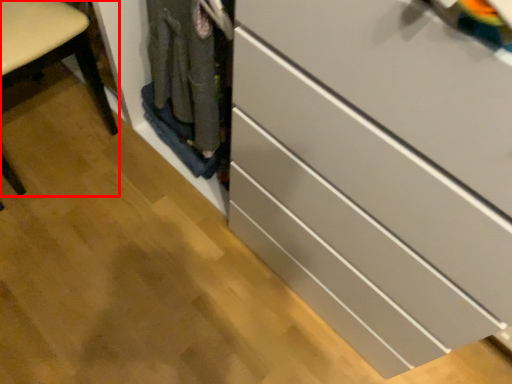
Question: In this image, where is furniture (annotated by the red box) located relative to chest of drawers?

Choices:
 (A) right
 (B) left

Answer: (B)